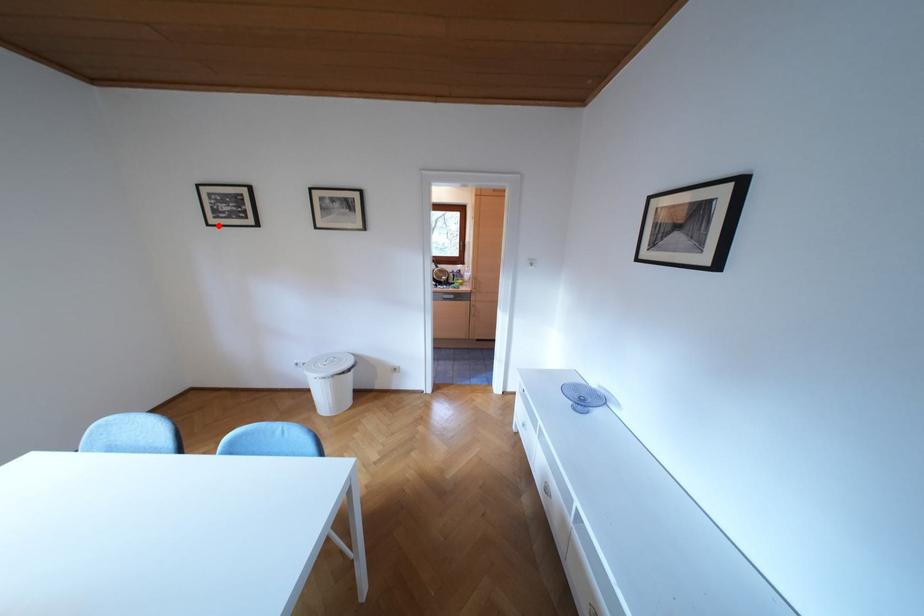
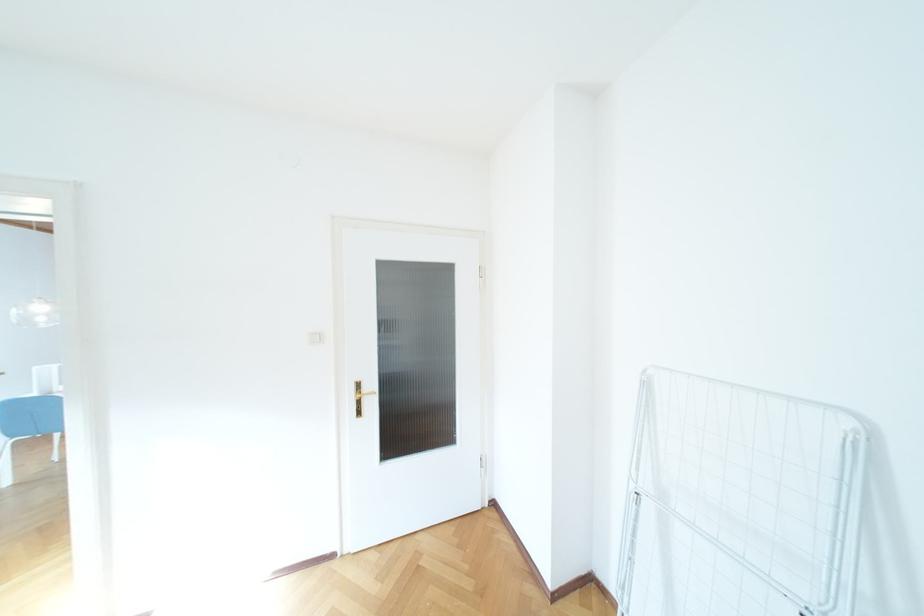
Question: I am providing you with two images of the same scene from different viewpoints. A red point is marked on the first image. Is the red point's position out of view in image 2?

Choices:
 (A) Yes
 (B) No

Answer: (A)